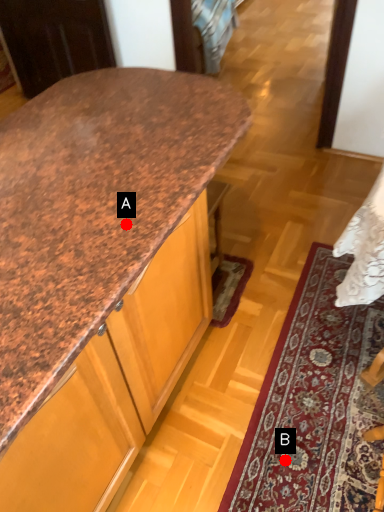
Question: Two points are circled on the image, labeled by A and B beside each circle. Which point is farther from the camera taking this photo?

Choices:
 (A) A is further
 (B) B is further

Answer: (B)